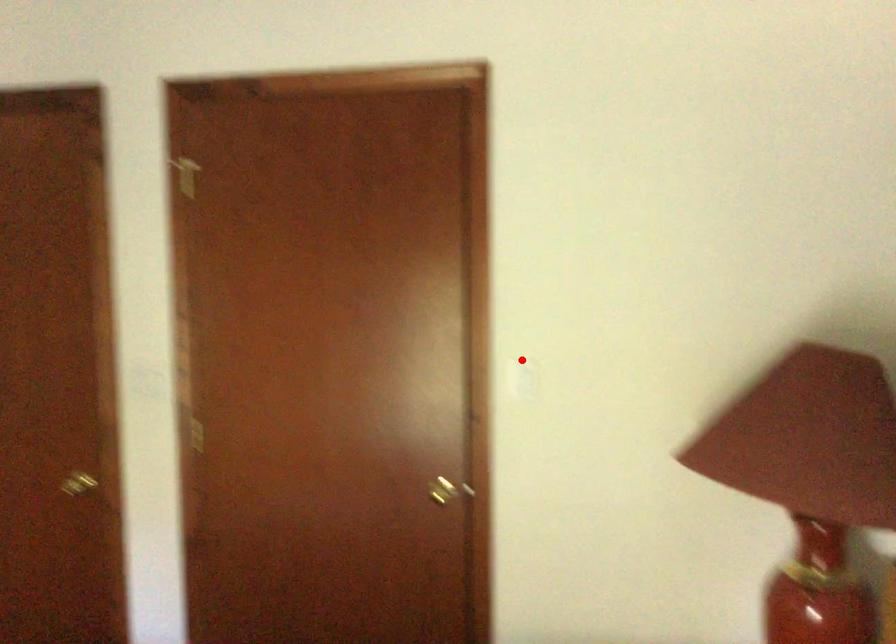
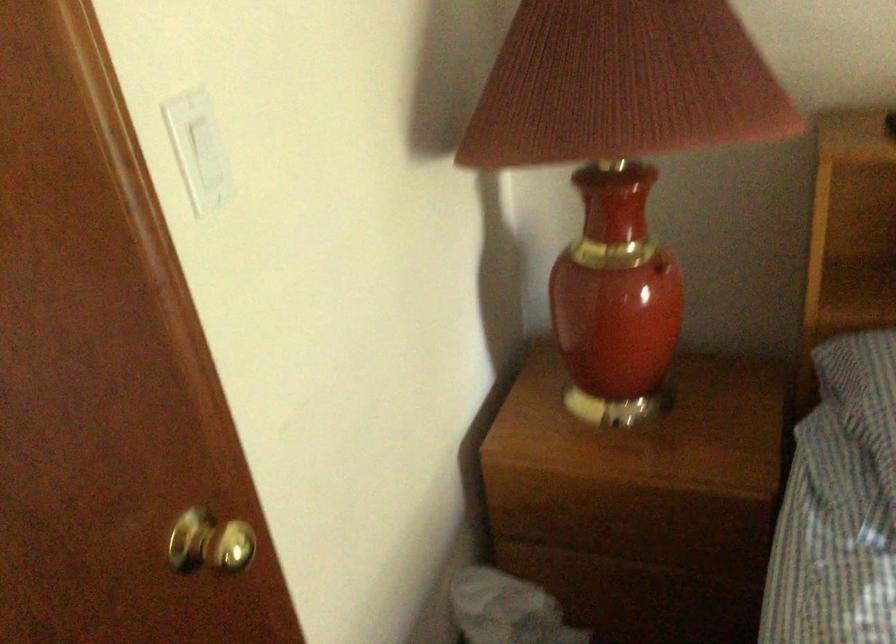
Find the pixel in the second image that matches the highlighted location in the first image.

(197, 149)